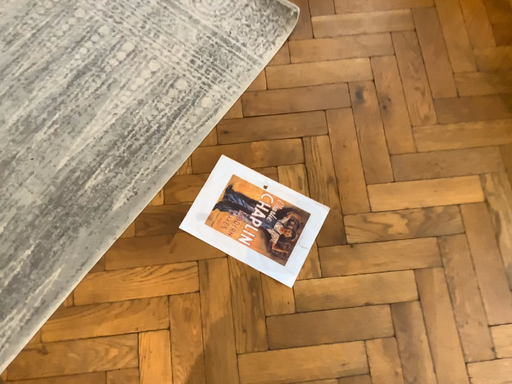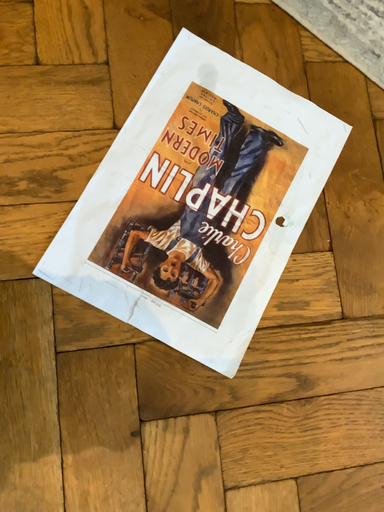
Question: How did the camera likely rotate when shooting the video?

Choices:
 (A) rotated downward
 (B) rotated upward

Answer: (B)